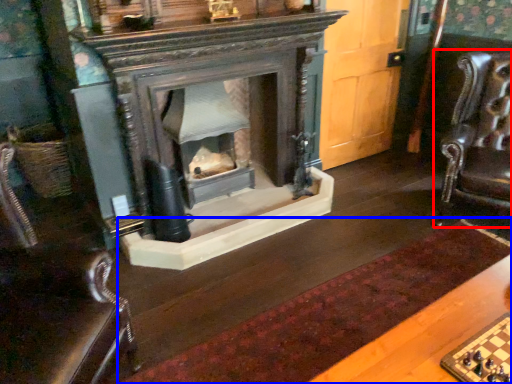
Question: Which point is closer to the camera, swivel chair (highlighted by a red box) or mat (highlighted by a blue box)?

Choices:
 (A) swivel chair
 (B) mat

Answer: (B)